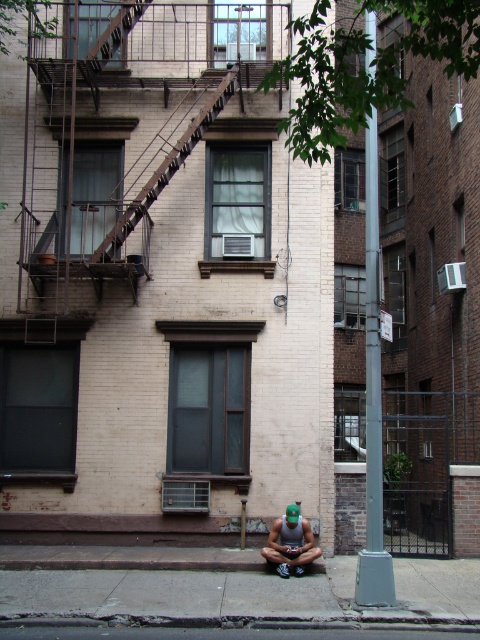
You are a delivery person who needs to place a heavy box on the ground. The box is 1 meter tall. You see the silver metallic pole at center and the smooth concrete pavement at lower center. Which surface can you safely place the box without it being obstructed by the pole?

The smooth concrete pavement at lower center is the safe surface to place the box since the silver metallic pole at center is positioned over it, meaning the pole is above the pavement. Placing the box on the pavement won

You are a delivery person trying to place a package on the sidewalk in front of the building. There are two objects in your way. Which object is closer to the ground? Please choose between the silver metallic pole at center and the green fabric squat at lower center.

The green fabric squat at lower center is closer to the ground because the silver metallic pole at center is located above it.